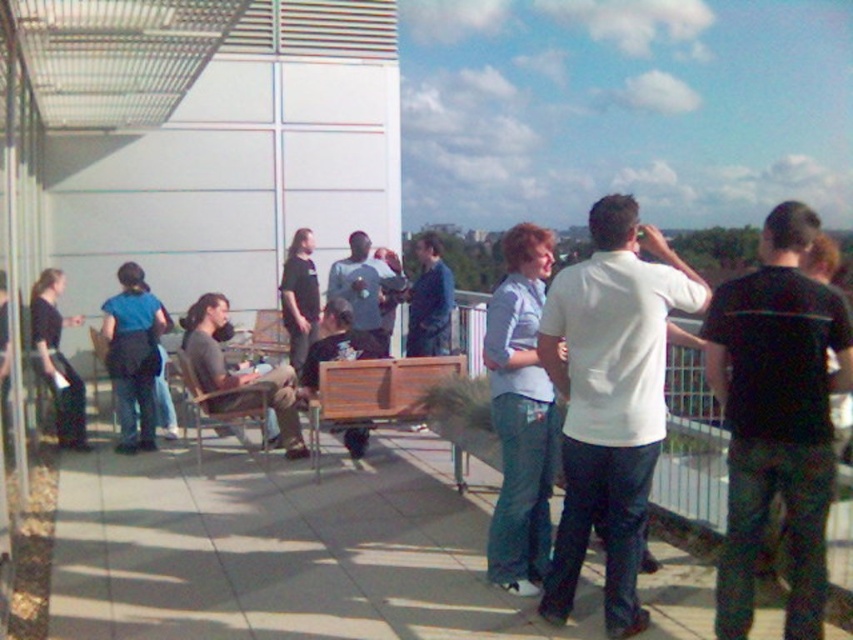
Can you confirm if matte gray shirt at center is wider than brown wooden bench at center?

In fact, matte gray shirt at center might be narrower than brown wooden bench at center.

Is point (378, 310) in front of point (239, 396)?

That is False.

The image size is (853, 640). Find the location of `matte gray shirt at center`. matte gray shirt at center is located at coordinates (364, 288).

Between black cotton shirt at right and white matte shirt at center, which one appears on the right side from the viewer's perspective?

Positioned to the right is black cotton shirt at right.

Is point (738, 362) in front of point (663, 369)?

That is True.

I want to click on black cotton shirt at right, so click(776, 417).

Can you confirm if white matte shirt at center is smaller than blue denim jacket at center?

Yes.

Image resolution: width=853 pixels, height=640 pixels. I want to click on white matte shirt at center, so click(x=610, y=401).